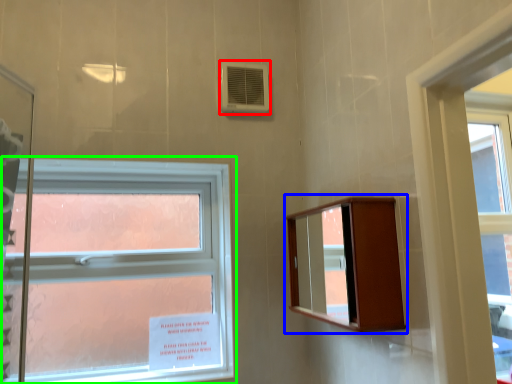
Question: Estimate the real-world distances between objects in this image. Which object is closer to air conditioning (highlighted by a red box), medicine cabinet (highlighted by a blue box) or window (highlighted by a green box)?

Choices:
 (A) medicine cabinet
 (B) window

Answer: (B)